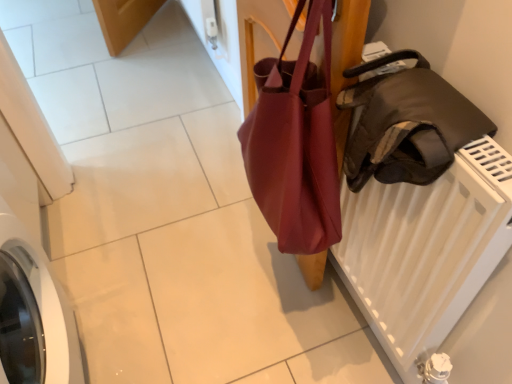
Question: Is matte brown bag at center not close to leather jacket at right?

Choices:
 (A) yes
 (B) no

Answer: (B)

Question: Considering the relative sizes of matte brown bag at center and leather jacket at right in the image provided, is matte brown bag at center shorter than leather jacket at right?

Choices:
 (A) no
 (B) yes

Answer: (A)

Question: Does matte brown bag at center turn towards leather jacket at right?

Choices:
 (A) yes
 (B) no

Answer: (B)

Question: Does matte brown bag at center have a greater height compared to leather jacket at right?

Choices:
 (A) no
 (B) yes

Answer: (B)

Question: Can you confirm if matte brown bag at center is bigger than leather jacket at right?

Choices:
 (A) yes
 (B) no

Answer: (A)

Question: From a real-world perspective, is matte brown bag at center physically below leather jacket at right?

Choices:
 (A) no
 (B) yes

Answer: (B)

Question: From the image's perspective, is leather jacket at right on matte brown bag at center?

Choices:
 (A) no
 (B) yes

Answer: (A)

Question: Is leather jacket at right facing away from matte brown bag at center?

Choices:
 (A) no
 (B) yes

Answer: (A)

Question: Does leather jacket at right appear on the right side of matte brown bag at center?

Choices:
 (A) no
 (B) yes

Answer: (B)

Question: Is leather jacket at right to the left of matte brown bag at center from the viewer's perspective?

Choices:
 (A) yes
 (B) no

Answer: (B)

Question: Is leather jacket at right positioned far away from matte brown bag at center?

Choices:
 (A) no
 (B) yes

Answer: (A)

Question: Is leather jacket at right bigger than matte brown bag at center?

Choices:
 (A) no
 (B) yes

Answer: (A)

Question: In the image, is matte brown bag at center positioned in front of or behind leather jacket at right?

Choices:
 (A) behind
 (B) front

Answer: (A)